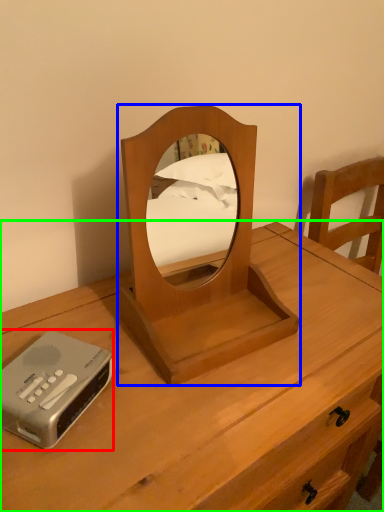
Question: Considering the real-world distances, which object is closest to cassette (highlighted by a red box)? mirror (highlighted by a blue box) or nightstand (highlighted by a green box).

Choices:
 (A) mirror
 (B) nightstand

Answer: (A)